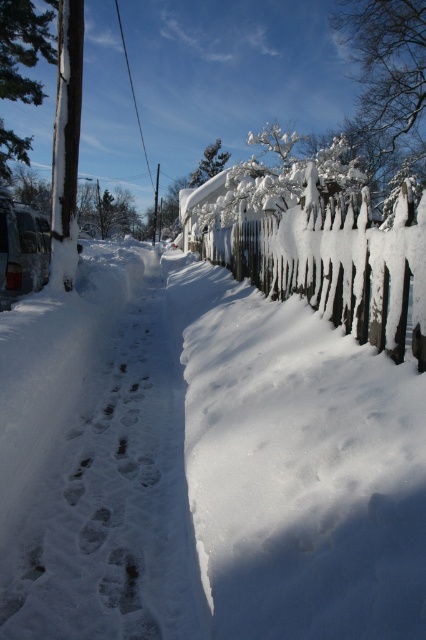
Can you confirm if white snow at center is positioned to the left of snow-covered wooden fence at right?

Yes, white snow at center is to the left of snow-covered wooden fence at right.

Who is more forward, (23,312) or (356,209)?

Positioned in front is point (356,209).

Is point (80, 458) farther from viewer compared to point (342, 218)?

Yes, it is behind point (342, 218).

Where is `white snow at center`? The width and height of the screenshot is (426, 640). white snow at center is located at coordinates (94, 460).